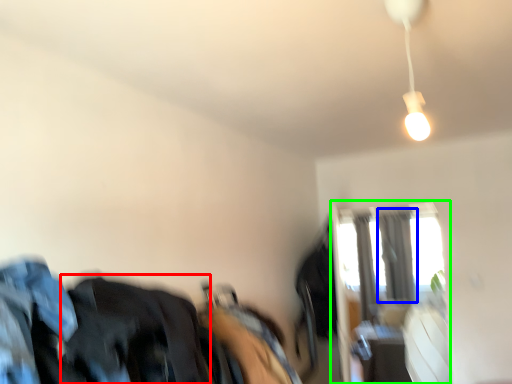
Question: Estimate the real-world distances between objects in this image. Which object is closer to clothing (highlighted by a red box), curtain (highlighted by a blue box) or window (highlighted by a green box)?

Choices:
 (A) curtain
 (B) window

Answer: (B)